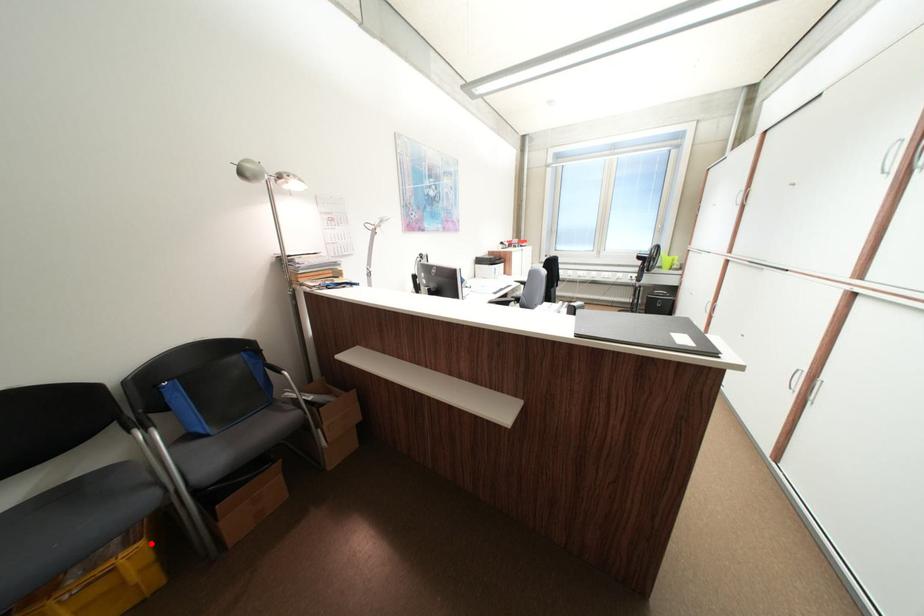
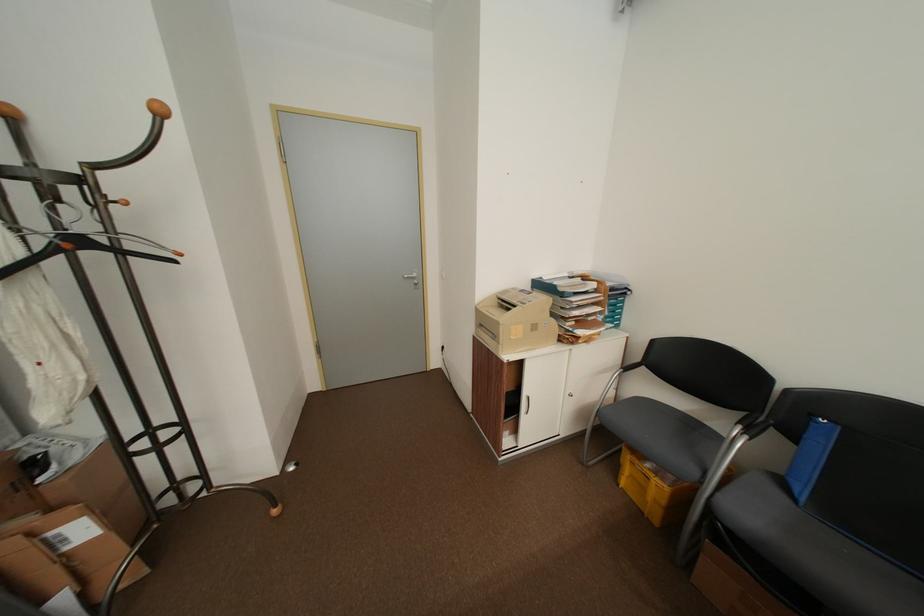
Question: I am providing you with two images of the same scene from different viewpoints. Image1 has a red point marked. In image2, the corresponding 3D location appears at what relative position? Reply with the corresponding letter.

Choices:
 (A) Closer
 (B) Farther

Answer: (B)